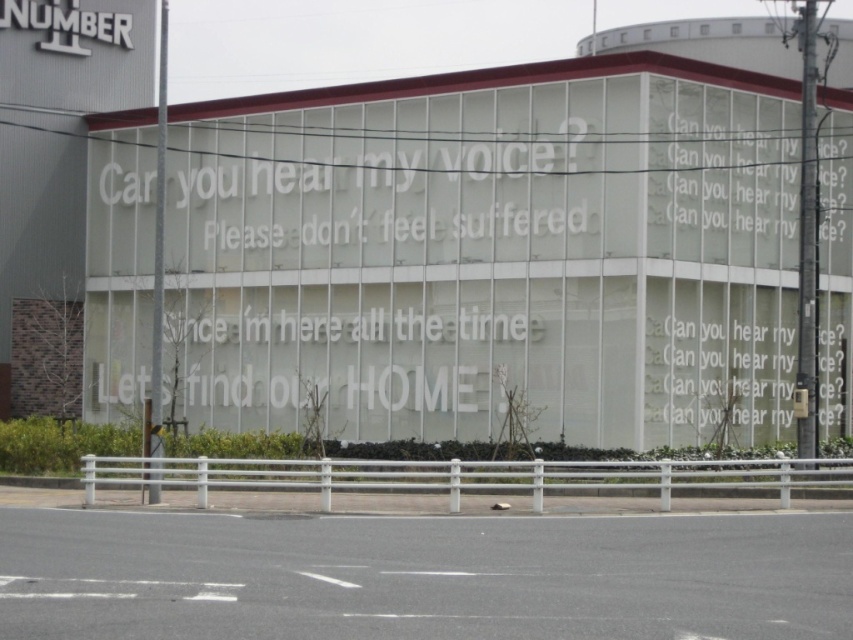
Looking at this image, who is higher up, white metallic sign at upper left or white paper text at upper right?

white metallic sign at upper left

Which is behind, point (68, 1) or point (825, 122)?

The point (68, 1) is more distant.

What do you see at coordinates (67, 24) in the screenshot? This screenshot has width=853, height=640. I see `white metallic sign at upper left` at bounding box center [67, 24].

The height and width of the screenshot is (640, 853). I want to click on white metallic sign at upper left, so click(67, 24).